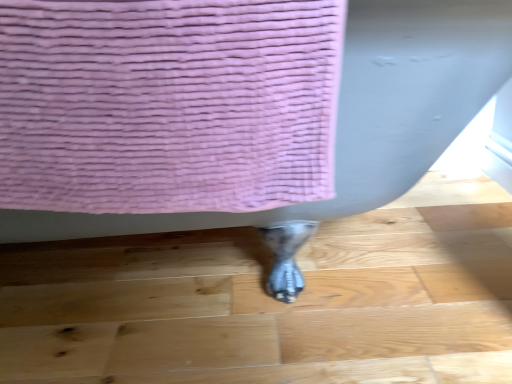
What do you see at coordinates (167, 104) in the screenshot? I see `pink textured towel at upper left` at bounding box center [167, 104].

Locate an element on the screen. Image resolution: width=512 pixels, height=384 pixels. pink textured towel at upper left is located at coordinates (167, 104).

In order to face pink textured towel at upper left, should I rotate leftwards or rightwards?

A 14.874 degree turn to the left will do.

Locate an element on the screen. The height and width of the screenshot is (384, 512). pink textured towel at upper left is located at coordinates (167, 104).